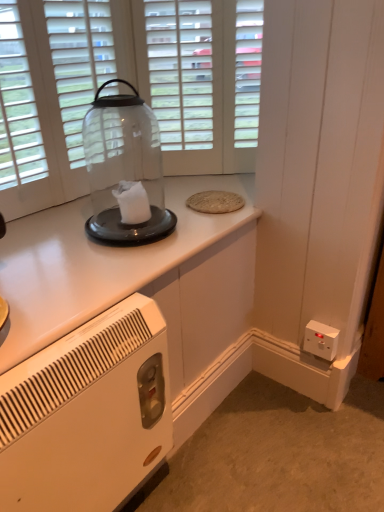
Question: From the image's perspective, is white glossy cabinet at upper center over white plastic heater at lower left?

Choices:
 (A) yes
 (B) no

Answer: (A)

Question: From a real-world perspective, is white glossy cabinet at upper center located beneath white plastic heater at lower left?

Choices:
 (A) no
 (B) yes

Answer: (A)

Question: From the image's perspective, is white glossy cabinet at upper center under white plastic heater at lower left?

Choices:
 (A) yes
 (B) no

Answer: (B)

Question: Can you confirm if white glossy cabinet at upper center is bigger than white plastic heater at lower left?

Choices:
 (A) no
 (B) yes

Answer: (B)

Question: Would you say white glossy cabinet at upper center is outside white plastic heater at lower left?

Choices:
 (A) yes
 (B) no

Answer: (A)

Question: Is transparent glass jar at center inside or outside of transparent glass door at upper center?

Choices:
 (A) outside
 (B) inside

Answer: (A)

Question: In the image, is transparent glass jar at center positioned in front of or behind transparent glass door at upper center?

Choices:
 (A) front
 (B) behind

Answer: (A)

Question: Is transparent glass jar at center wider or thinner than transparent glass door at upper center?

Choices:
 (A) wide
 (B) thin

Answer: (A)

Question: Would you say transparent glass jar at center is to the left or to the right of transparent glass door at upper center in the picture?

Choices:
 (A) right
 (B) left

Answer: (B)

Question: From their relative heights in the image, would you say transparent glass jar at center is taller or shorter than white glossy cabinet at upper center?

Choices:
 (A) short
 (B) tall

Answer: (B)

Question: Is transparent glass jar at center to the left or to the right of white glossy cabinet at upper center in the image?

Choices:
 (A) left
 (B) right

Answer: (B)

Question: Relative to white glossy cabinet at upper center, is transparent glass jar at center in front or behind?

Choices:
 (A) behind
 (B) front

Answer: (A)

Question: Is transparent glass jar at center spatially inside white glossy cabinet at upper center, or outside of it?

Choices:
 (A) outside
 (B) inside

Answer: (A)

Question: Considering the positions of transparent glass jar at center and white plastic electrical outlet at lower right in the image, is transparent glass jar at center taller or shorter than white plastic electrical outlet at lower right?

Choices:
 (A) tall
 (B) short

Answer: (A)

Question: Considering the positions of point tap(107, 224) and point tap(316, 330), is point tap(107, 224) closer or farther from the camera than point tap(316, 330)?

Choices:
 (A) closer
 (B) farther

Answer: (A)